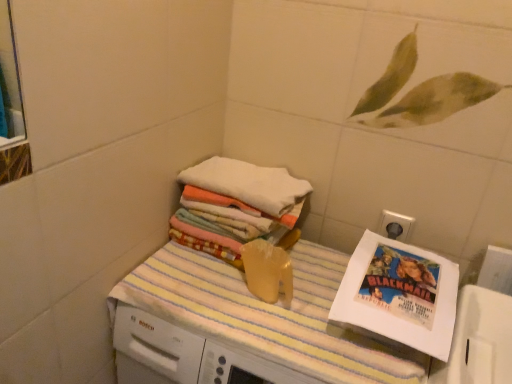
Question: Could you tell me if white paper comic book at right is turned towards white soft towels at upper center?

Choices:
 (A) no
 (B) yes

Answer: (A)

Question: Is white paper comic book at right closer to camera compared to white soft towels at upper center?

Choices:
 (A) no
 (B) yes

Answer: (B)

Question: Is white paper comic book at right positioned behind white soft towels at upper center?

Choices:
 (A) yes
 (B) no

Answer: (B)

Question: Does white paper comic book at right appear on the right side of white soft towels at upper center?

Choices:
 (A) no
 (B) yes

Answer: (B)

Question: From a real-world perspective, is white paper comic book at right on top of white soft towels at upper center?

Choices:
 (A) yes
 (B) no

Answer: (B)

Question: From the image's perspective, is white plastic electric outlet at upper right located above or below yellow striped towel at center?

Choices:
 (A) below
 (B) above

Answer: (B)

Question: Looking at the image, does white plastic electric outlet at upper right seem bigger or smaller compared to yellow striped towel at center?

Choices:
 (A) big
 (B) small

Answer: (B)

Question: Would you say white plastic electric outlet at upper right is inside or outside yellow striped towel at center?

Choices:
 (A) inside
 (B) outside

Answer: (B)

Question: From a real-world perspective, is white plastic electric outlet at upper right above or below yellow striped towel at center?

Choices:
 (A) below
 (B) above

Answer: (B)

Question: From the image's perspective, is yellow striped towel at center above or below white paper comic book at right?

Choices:
 (A) below
 (B) above

Answer: (A)

Question: Considering the positions of yellow striped towel at center and white paper comic book at right in the image, is yellow striped towel at center bigger or smaller than white paper comic book at right?

Choices:
 (A) small
 (B) big

Answer: (B)

Question: Based on their positions, is yellow striped towel at center located to the left or right of white paper comic book at right?

Choices:
 (A) left
 (B) right

Answer: (A)

Question: From their relative heights in the image, would you say yellow striped towel at center is taller or shorter than white paper comic book at right?

Choices:
 (A) short
 (B) tall

Answer: (B)

Question: Considering the positions of point (410, 226) and point (419, 278), is point (410, 226) closer or farther from the camera than point (419, 278)?

Choices:
 (A) closer
 (B) farther

Answer: (B)

Question: Relative to white paper comic book at right, is white plastic electric outlet at upper right in front or behind?

Choices:
 (A) behind
 (B) front

Answer: (A)